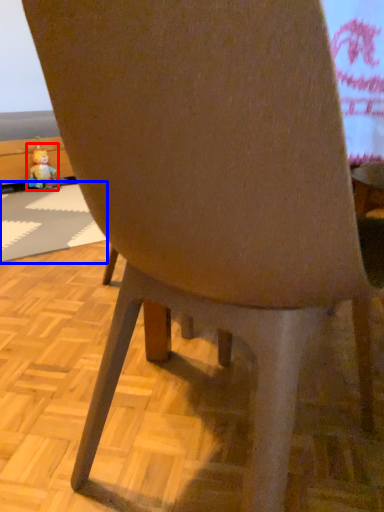
Question: Which of the following is the farthest to the observer, toy (highlighted by a red box) or place mat (highlighted by a blue box)?

Choices:
 (A) toy
 (B) place mat

Answer: (A)